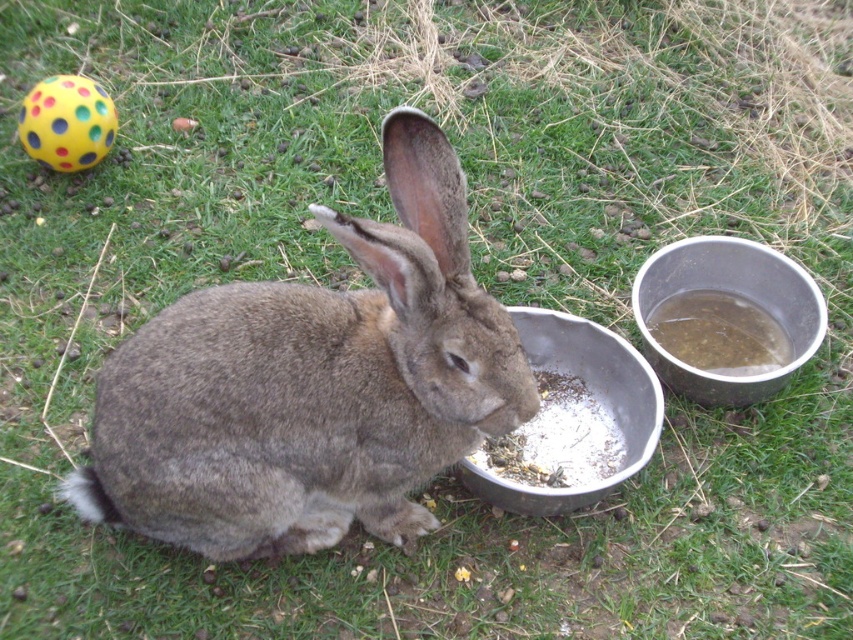
You are a pet owner who wants to ensure the fuzzy gray rabbit at center has enough space to eat comfortably. The metallic silver bowl at right is placed next to it. Based on their sizes, is the bowl likely too small for the rabbit to access easily?

The fuzzy gray rabbit at center is taller than the metallic silver bowl at right, so the bowl might be too small for the rabbit to access easily as it may need a taller or wider bowl to eat comfortably.

You are a gardener who wants to place a new decorative stone on the grass near the fuzzy gray rabbit at center and the metallic gray bowl at lower center. Which object should you place the stone closer to if you want it to be near the rabbit but not directly on the bowl?

The fuzzy gray rabbit at center is positioned over the metallic gray bowl at lower center, so placing the stone closer to the rabbit would mean positioning it near the rabbit but not directly on the bowl.